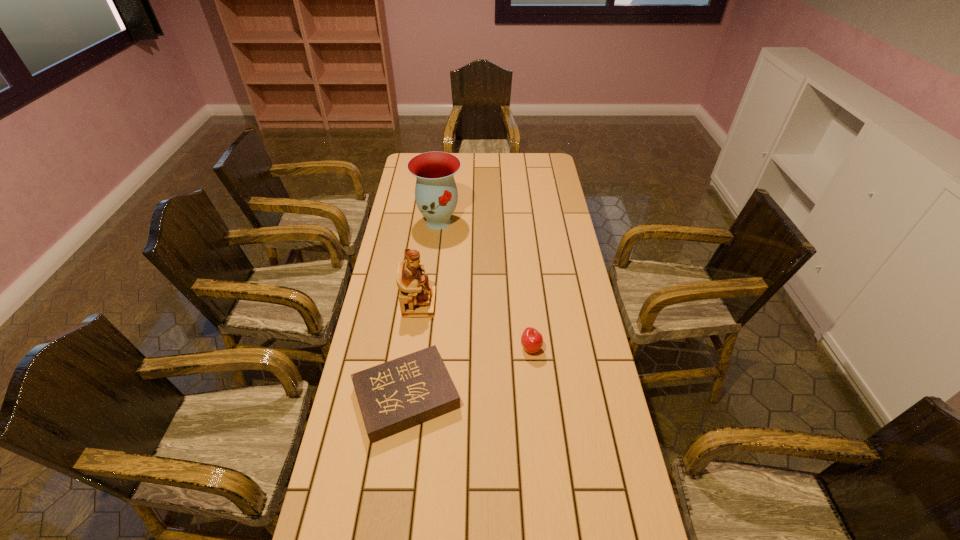
Where is `object that ranks as the closest to the second farthest object`? object that ranks as the closest to the second farthest object is located at coordinates (394, 396).

Choose which object is the nearest neighbor to the vase. Please provide its 2D coordinates. Your answer should be formatted as a tuple, i.e. [(x, y)], where the tuple contains the x and y coordinates of a point satisfying the conditions above.

[(417, 298)]

Where is `blank area in the image that satisfies the following two spatial constraints: 1. on the back side of the shortest object; 2. on the right side of the second shortest object`? The image size is (960, 540). blank area in the image that satisfies the following two spatial constraints: 1. on the back side of the shortest object; 2. on the right side of the second shortest object is located at coordinates (413, 348).

Identify the location of free spot that satisfies the following two spatial constraints: 1. on the back side of the hardback book; 2. on the left side of the apple. (413, 348).